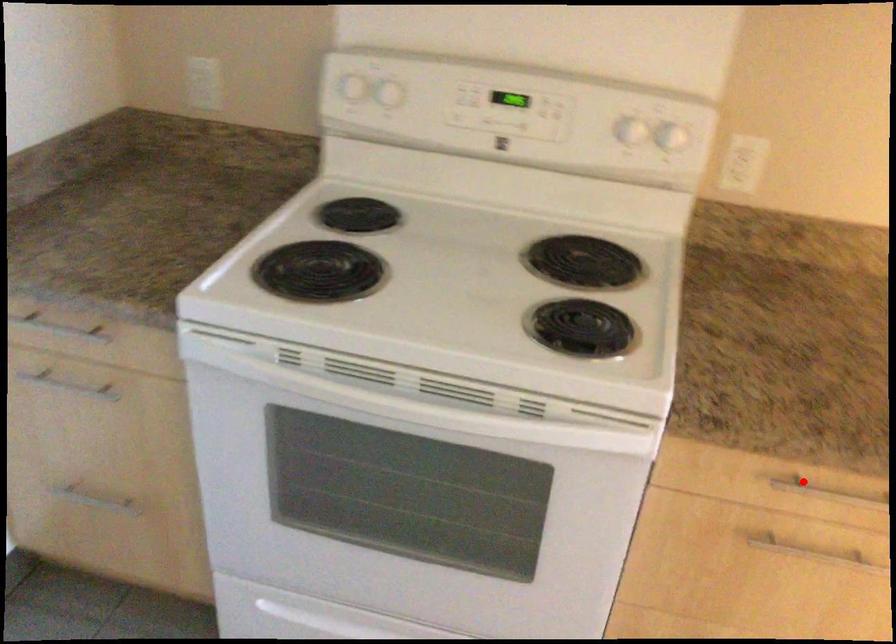
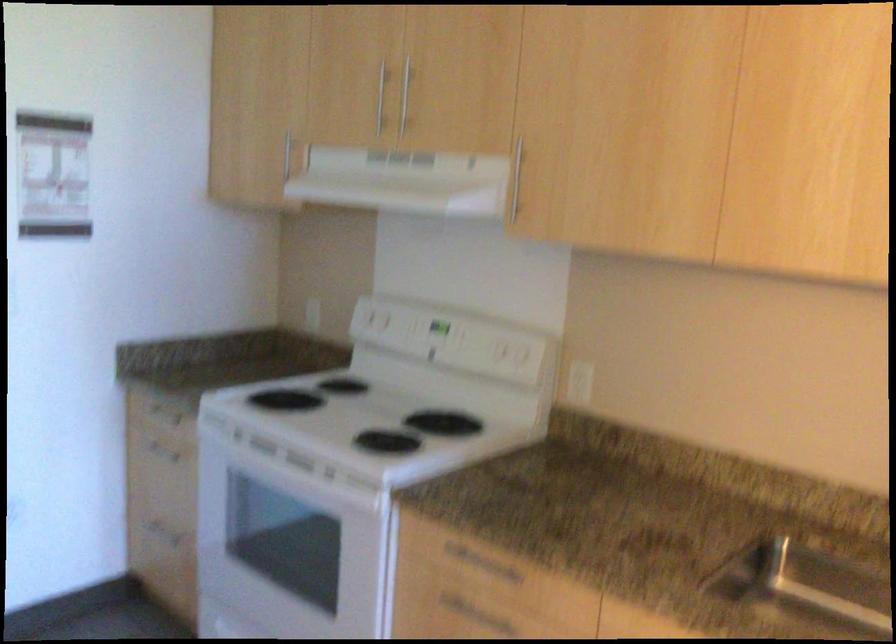
Find the pixel in the second image that matches the highlighted location in the first image.

(480, 564)